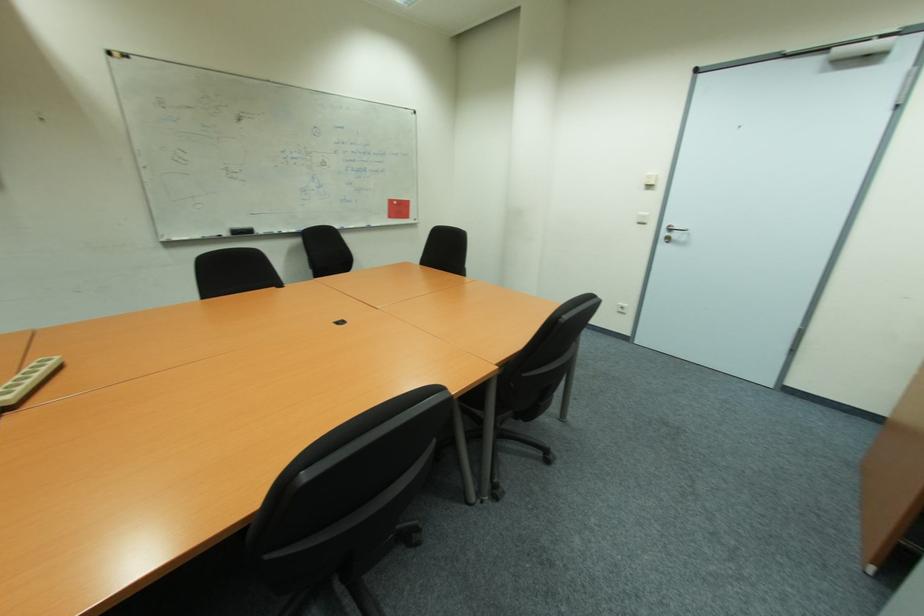
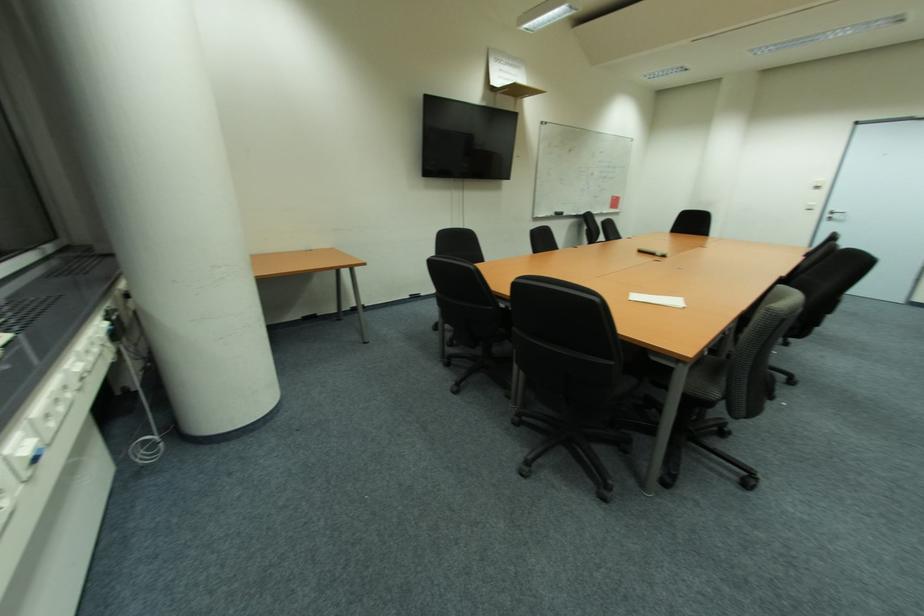
The point at (677, 236) is marked in the first image. Where is the corresponding point in the second image?

(842, 217)